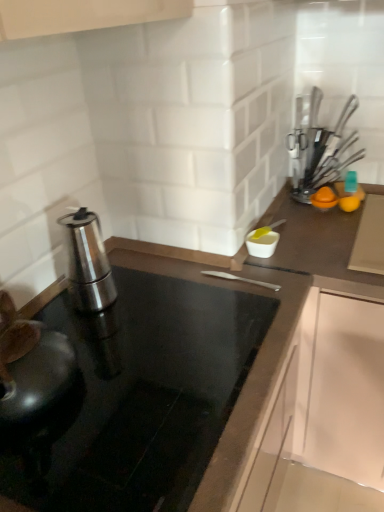
The height and width of the screenshot is (512, 384). What do you see at coordinates (87, 262) in the screenshot? I see `polished stainless steel espresso maker at left, acting as the 1th kitchen appliance starting from the bottom` at bounding box center [87, 262].

How much space does metallic silver utensils at upper right, which appears as the second kitchen appliance when ordered from the bottom, occupy vertically?

→ 31.99 centimeters.

In order to face metallic silver utensils at upper right, which appears as the second kitchen appliance when ordered from the bottom, should I rotate leftwards or rightwards?

It's best to rotate right around 17.934 degrees.

This screenshot has height=512, width=384. Identify the location of black glass countertop at center. (253, 387).

From a real-world perspective, is metallic silver utensils at upper right, arranged as the 2th kitchen appliance when viewed from the left, physically above polished stainless steel espresso maker at left, arranged as the second kitchen appliance when viewed from the top?

Yes, from a real-world perspective, metallic silver utensils at upper right, arranged as the 2th kitchen appliance when viewed from the left, is on top of polished stainless steel espresso maker at left, arranged as the second kitchen appliance when viewed from the top.

Which object is positioned more to the right, metallic silver utensils at upper right, arranged as the 2th kitchen appliance when viewed from the left, or polished stainless steel espresso maker at left, which is the 1th kitchen appliance in left-to-right order?

metallic silver utensils at upper right, arranged as the 2th kitchen appliance when viewed from the left.

In the image, is metallic silver utensils at upper right, acting as the first kitchen appliance starting from the top, positioned in front of or behind polished stainless steel espresso maker at left, which is the 1th kitchen appliance in left-to-right order?

metallic silver utensils at upper right, acting as the first kitchen appliance starting from the top, is positioned farther from the viewer than polished stainless steel espresso maker at left, which is the 1th kitchen appliance in left-to-right order.

Considering the sizes of metallic silver utensils at upper right, which appears as the second kitchen appliance when ordered from the bottom, and polished stainless steel espresso maker at left, acting as the 1th kitchen appliance starting from the bottom, in the image, is metallic silver utensils at upper right, which appears as the second kitchen appliance when ordered from the bottom, bigger or smaller than polished stainless steel espresso maker at left, acting as the 1th kitchen appliance starting from the bottom,?

In the image, metallic silver utensils at upper right, which appears as the second kitchen appliance when ordered from the bottom, appears to be smaller than polished stainless steel espresso maker at left, acting as the 1th kitchen appliance starting from the bottom.

Consider the image. How much distance is there between polished stainless steel espresso maker at left, the second kitchen appliance viewed from the right, and metallic silver utensils at upper right, which appears as the second kitchen appliance when ordered from the bottom?

polished stainless steel espresso maker at left, the second kitchen appliance viewed from the right, is 30.68 inches away from metallic silver utensils at upper right, which appears as the second kitchen appliance when ordered from the bottom.

How many degrees apart are the facing directions of polished stainless steel espresso maker at left, which is the 1th kitchen appliance in left-to-right order, and metallic silver utensils at upper right, acting as the first kitchen appliance starting from the top?

The angular difference between polished stainless steel espresso maker at left, which is the 1th kitchen appliance in left-to-right order, and metallic silver utensils at upper right, acting as the first kitchen appliance starting from the top, is 90 degrees.

Which object is wider, polished stainless steel espresso maker at left, the second kitchen appliance viewed from the right, or metallic silver utensils at upper right, which appears as the second kitchen appliance when ordered from the bottom?

With larger width is polished stainless steel espresso maker at left, the second kitchen appliance viewed from the right.

From a real-world perspective, between polished stainless steel espresso maker at left, the second kitchen appliance viewed from the right, and metallic silver utensils at upper right, acting as the first kitchen appliance starting from the top, who is vertically lower?

polished stainless steel espresso maker at left, the second kitchen appliance viewed from the right, is physically lower.

From the image's perspective, does metallic silver utensils at upper right, marked as the 2th kitchen appliance in a front-to-back arrangement, appear lower than black glass countertop at center?

No, from the image's perspective, metallic silver utensils at upper right, marked as the 2th kitchen appliance in a front-to-back arrangement, is not below black glass countertop at center.

Are metallic silver utensils at upper right, the first kitchen appliance viewed from the right, and black glass countertop at center far apart?

No, there isn't a large distance between metallic silver utensils at upper right, the first kitchen appliance viewed from the right, and black glass countertop at center.

Is metallic silver utensils at upper right, which appears as the second kitchen appliance when ordered from the bottom, at the left side of black glass countertop at center?

No, metallic silver utensils at upper right, which appears as the second kitchen appliance when ordered from the bottom, is not to the left of black glass countertop at center.

Which is correct: metallic silver utensils at upper right, acting as the first kitchen appliance starting from the back, is inside black glass countertop at center, or outside of it?

metallic silver utensils at upper right, acting as the first kitchen appliance starting from the back, exists outside the volume of black glass countertop at center.

Find the location of a particular element. Image resolution: width=384 pixels, height=512 pixels. countertop below the metallic silver utensils at upper right, the first kitchen appliance viewed from the right (from the image's perspective) is located at coordinates (253, 387).

Which is closer to the camera, (304, 298) or (309, 138)?

Point (304, 298)

From the picture: Considering the relative positions of black glass countertop at center and metallic silver utensils at upper right, arranged as the 2th kitchen appliance when viewed from the left, in the image provided, is black glass countertop at center to the left of metallic silver utensils at upper right, arranged as the 2th kitchen appliance when viewed from the left, from the viewer's perspective?

Yes.

Is black glass countertop at center outside of metallic silver utensils at upper right, acting as the first kitchen appliance starting from the back?

black glass countertop at center lies outside metallic silver utensils at upper right, acting as the first kitchen appliance starting from the back,'s area.

Where is `countertop on the right of the polished stainless steel espresso maker at left, the second kitchen appliance viewed from the right`? This screenshot has width=384, height=512. countertop on the right of the polished stainless steel espresso maker at left, the second kitchen appliance viewed from the right is located at coordinates point(253,387).

Is point (123, 250) farther from camera compared to point (83, 280)?

Yes, it is behind point (83, 280).

Is black glass countertop at center looking in the opposite direction of polished stainless steel espresso maker at left, the second kitchen appliance viewed from the right?

No, black glass countertop at center's orientation is not away from polished stainless steel espresso maker at left, the second kitchen appliance viewed from the right.

How different are the orientations of black glass countertop at center and polished stainless steel espresso maker at left, acting as the 1th kitchen appliance starting from the bottom, in degrees?

black glass countertop at center and polished stainless steel espresso maker at left, acting as the 1th kitchen appliance starting from the bottom, are facing 0.000911 degrees away from each other.

From a real-world perspective, is polished stainless steel espresso maker at left, arranged as the 2th kitchen appliance when viewed from the back, above or below black glass countertop at center?

From a real-world perspective, polished stainless steel espresso maker at left, arranged as the 2th kitchen appliance when viewed from the back, is physically above black glass countertop at center.

Which is closer to the camera, (74, 237) or (227, 489)?

The point (227, 489) is closer to the camera.

Is polished stainless steel espresso maker at left, arranged as the 2th kitchen appliance when viewed from the back, far away from black glass countertop at center?

No, polished stainless steel espresso maker at left, arranged as the 2th kitchen appliance when viewed from the back, is not far from black glass countertop at center.

Is polished stainless steel espresso maker at left, which is the 1th kitchen appliance in left-to-right order, inside the boundaries of black glass countertop at center, or outside?

polished stainless steel espresso maker at left, which is the 1th kitchen appliance in left-to-right order, is spatially situated outside black glass countertop at center.

Locate an element on the screen. This screenshot has height=512, width=384. kitchen appliance above the polished stainless steel espresso maker at left, which is the first kitchen appliance from front to back (from the image's perspective) is located at coordinates (318, 146).

Locate an element on the screen. The height and width of the screenshot is (512, 384). kitchen appliance in front of the metallic silver utensils at upper right, acting as the first kitchen appliance starting from the top is located at coordinates (87, 262).

From the image, which object appears to be farther from metallic silver utensils at upper right, marked as the 2th kitchen appliance in a front-to-back arrangement, polished stainless steel espresso maker at left, which is the 1th kitchen appliance in left-to-right order, or black glass countertop at center?

polished stainless steel espresso maker at left, which is the 1th kitchen appliance in left-to-right order, is further to metallic silver utensils at upper right, marked as the 2th kitchen appliance in a front-to-back arrangement.

From the image, which object appears to be farther from polished stainless steel espresso maker at left, which is the 1th kitchen appliance in left-to-right order, metallic silver utensils at upper right, arranged as the 2th kitchen appliance when viewed from the left, or black glass countertop at center?

metallic silver utensils at upper right, arranged as the 2th kitchen appliance when viewed from the left.

Looking at this image, which object lies nearer to the anchor point metallic silver utensils at upper right, the first kitchen appliance viewed from the right, black glass countertop at center or polished stainless steel espresso maker at left, acting as the 1th kitchen appliance starting from the bottom?

Among the two, black glass countertop at center is located nearer to metallic silver utensils at upper right, the first kitchen appliance viewed from the right.

Based on their spatial positions, is metallic silver utensils at upper right, marked as the 2th kitchen appliance in a front-to-back arrangement, or polished stainless steel espresso maker at left, acting as the 1th kitchen appliance starting from the bottom, further from black glass countertop at center?

metallic silver utensils at upper right, marked as the 2th kitchen appliance in a front-to-back arrangement, lies further to black glass countertop at center than the other object.

Based on the photo, looking at the image, which one is located closer to polished stainless steel espresso maker at left, arranged as the 2th kitchen appliance when viewed from the back, black glass countertop at center or metallic silver utensils at upper right, which appears as the second kitchen appliance when ordered from the bottom?

black glass countertop at center lies closer to polished stainless steel espresso maker at left, arranged as the 2th kitchen appliance when viewed from the back, than the other object.

When comparing their distances from black glass countertop at center, does polished stainless steel espresso maker at left, which is the 1th kitchen appliance in left-to-right order, or metallic silver utensils at upper right, arranged as the 2th kitchen appliance when viewed from the left, seem closer?

polished stainless steel espresso maker at left, which is the 1th kitchen appliance in left-to-right order, lies closer to black glass countertop at center than the other object.

Locate an element on the screen. This screenshot has width=384, height=512. countertop between polished stainless steel espresso maker at left, which is the 1th kitchen appliance in left-to-right order, and metallic silver utensils at upper right, acting as the first kitchen appliance starting from the top, from left to right is located at coordinates (253, 387).